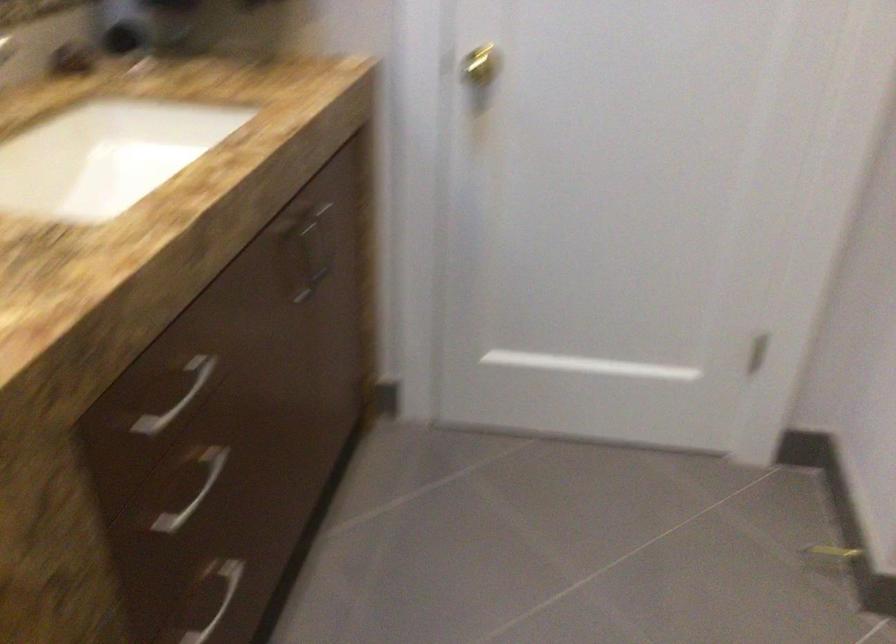
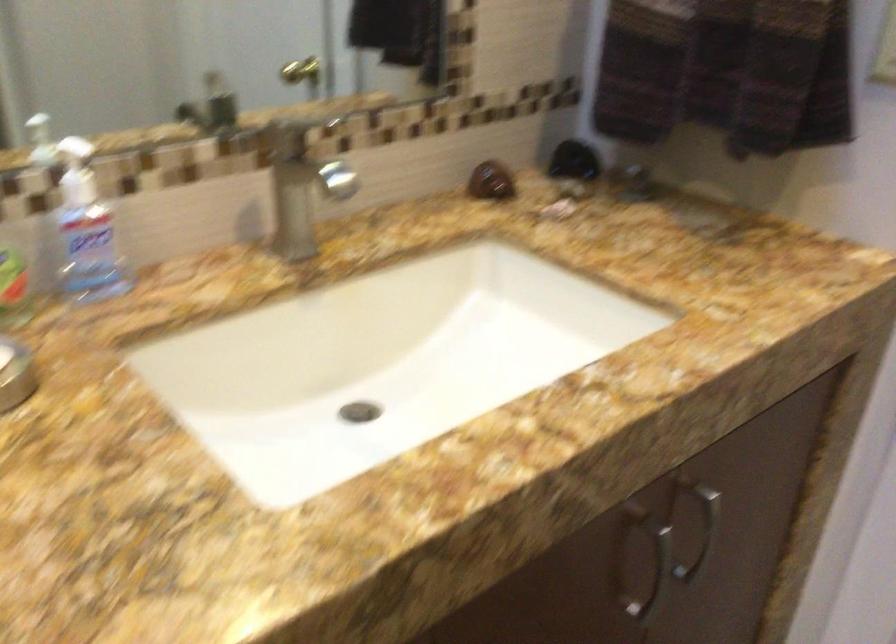
The point at (320,250) is marked in the first image. Where is the corresponding point in the second image?

(702, 533)